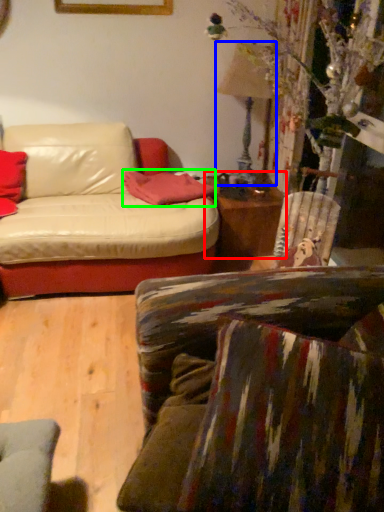
Question: Estimate the real-world distances between objects in this image. Which object is farther from table (highlighted by a red box), lamp (highlighted by a blue box) or pillow (highlighted by a green box)?

Choices:
 (A) lamp
 (B) pillow

Answer: (A)